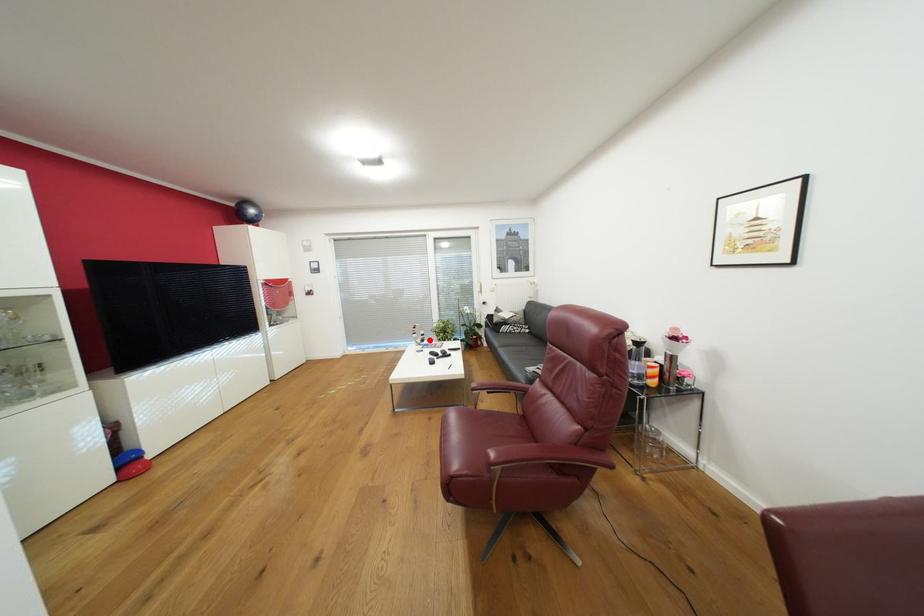
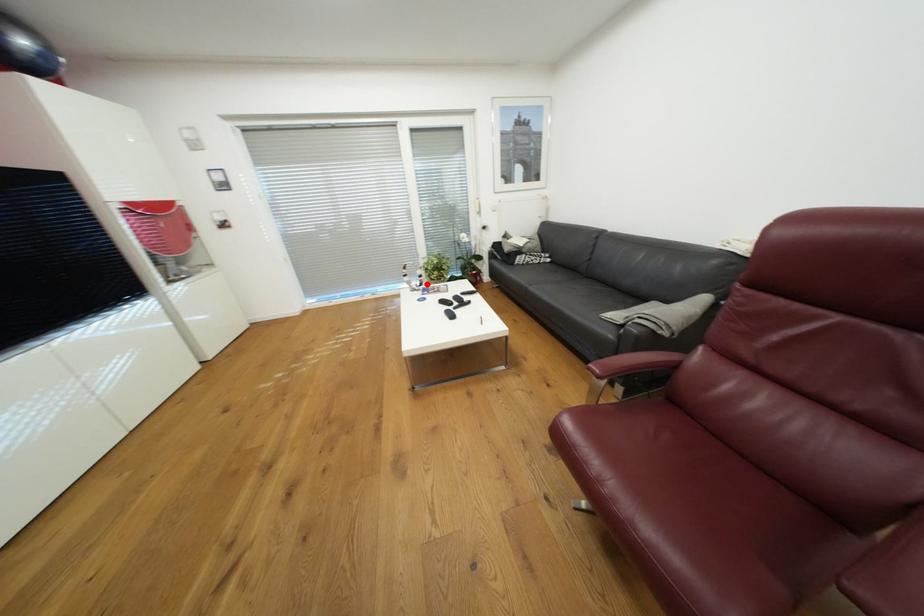
I am providing you with two images of the same scene from different viewpoints. A red point is marked on the first image and another point is marked on the second image. Is the marked point in image1 the same physical position as the marked point in image2?

Yes